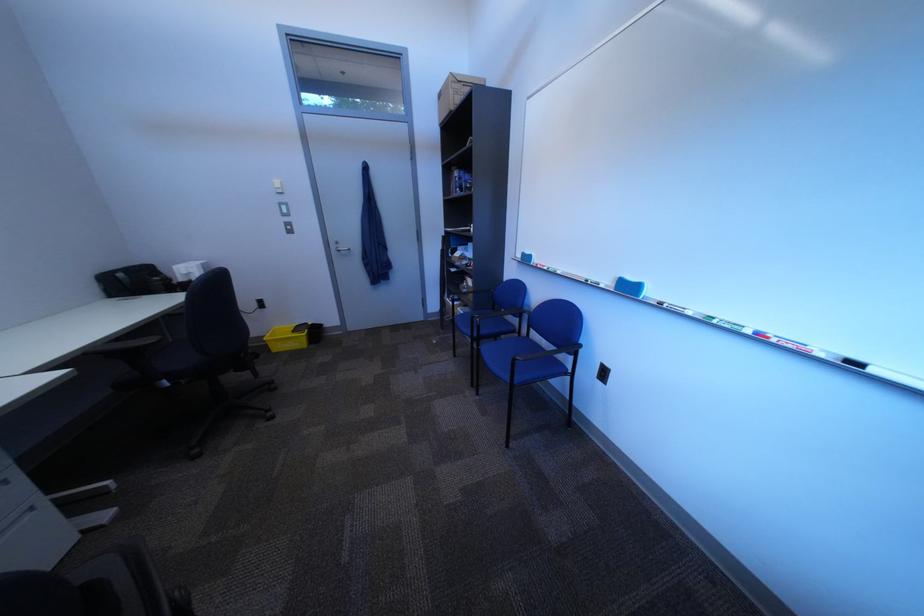
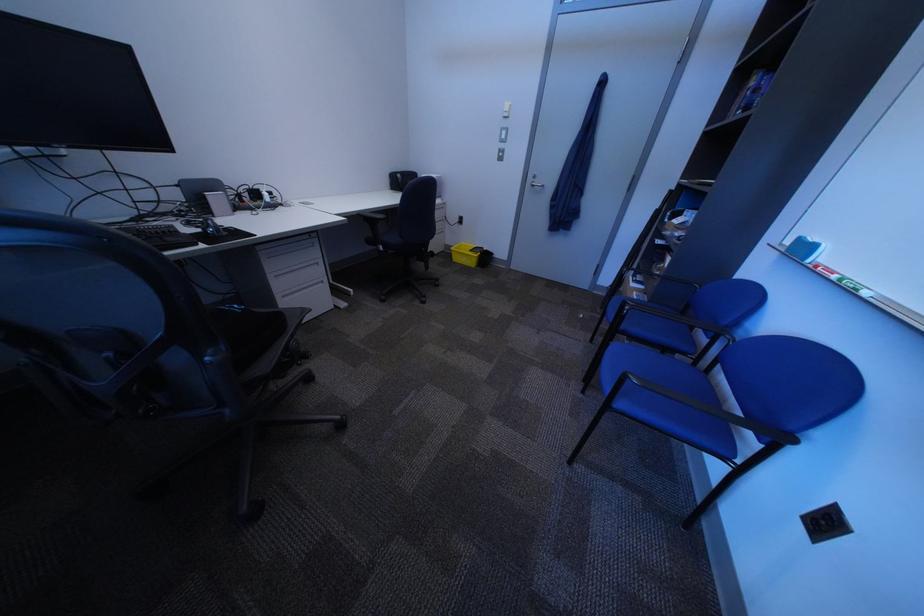
Where in the second image is the point corresponding to (532,360) from the first image?

(647, 379)